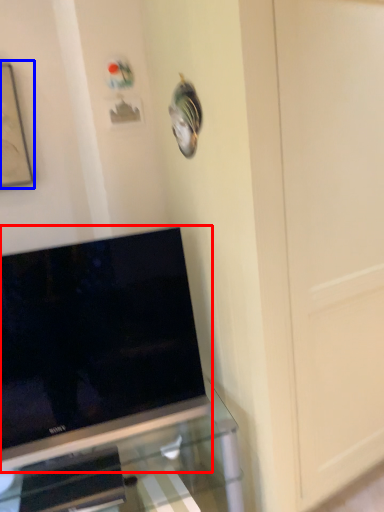
Question: Among these objects, which one is farthest to the camera, television (highlighted by a red box) or picture frame (highlighted by a blue box)?

Choices:
 (A) television
 (B) picture frame

Answer: (B)